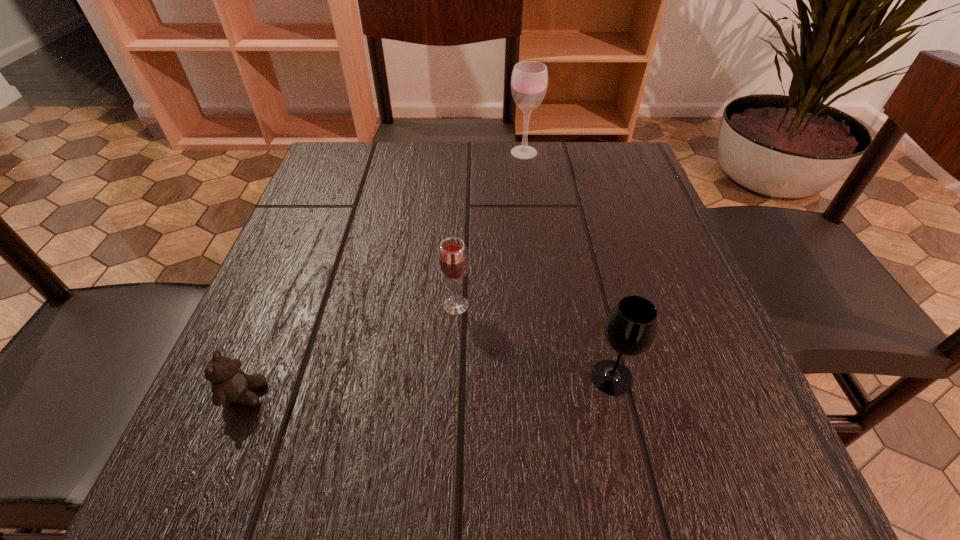
Find the location of a particular element. This screenshot has width=960, height=540. free space located 0.110m on the left of the leftmost wineglass is located at coordinates (375, 305).

Identify the location of free space located on the face of the shortest object. (384, 394).

Locate an element on the screen. Image resolution: width=960 pixels, height=540 pixels. object located in the far edge section of the desktop is located at coordinates (529, 80).

At what (x,y) coordinates should I click in order to perform the action: click on object present at the left edge. Please return your answer as a coordinate pair (x, y). The image size is (960, 540). Looking at the image, I should click on (230, 384).

At what (x,y) coordinates should I click in order to perform the action: click on object situated at the right edge. Please return your answer as a coordinate pair (x, y). Looking at the image, I should click on (630, 329).

Locate an element on the screen. free spot at the far edge of the desktop is located at coordinates (466, 145).

Locate an element on the screen. free space at the near edge is located at coordinates (624, 460).

Where is `free point at the left edge`? free point at the left edge is located at coordinates (358, 208).

Identify the location of free location at the right edge. (649, 350).

Where is `blank space at the far left corner of the desktop`? This screenshot has width=960, height=540. blank space at the far left corner of the desktop is located at coordinates (336, 193).